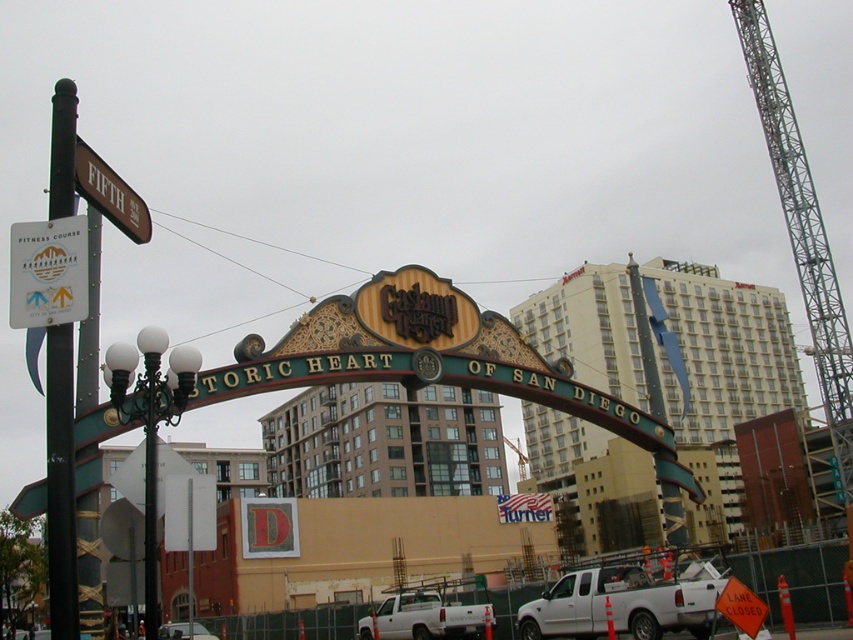
Does white matte truck at lower center appear on the right side of metallic silver car at center?

Indeed, white matte truck at lower center is positioned on the right side of metallic silver car at center.

Is white matte truck at lower center thinner than metallic silver car at center?

Correct, white matte truck at lower center's width is less than metallic silver car at center's.

Who is more forward, (418, 632) or (202, 636)?

Positioned in front is point (418, 632).

Where is `white matte truck at lower center`? Image resolution: width=853 pixels, height=640 pixels. white matte truck at lower center is located at coordinates (425, 618).

Consider the image. Who is more distant from viewer, [796,166] or [463,625]?

Point [796,166]

Looking at this image, is gray metallic crane at right positioned behind white matte truck at lower center?

Yes, it is.

Is point (770, 58) closer to viewer compared to point (422, 624)?

No, (770, 58) is behind (422, 624).

Where is `gray metallic crane at right`? The width and height of the screenshot is (853, 640). gray metallic crane at right is located at coordinates (801, 228).

Is point (477, 630) behind point (122, 205)?

Yes, point (477, 630) is behind point (122, 205).

What do you see at coordinates (425, 618) in the screenshot? This screenshot has width=853, height=640. I see `white matte truck at lower center` at bounding box center [425, 618].

Locate an element on the screen. white matte truck at lower center is located at coordinates (425, 618).